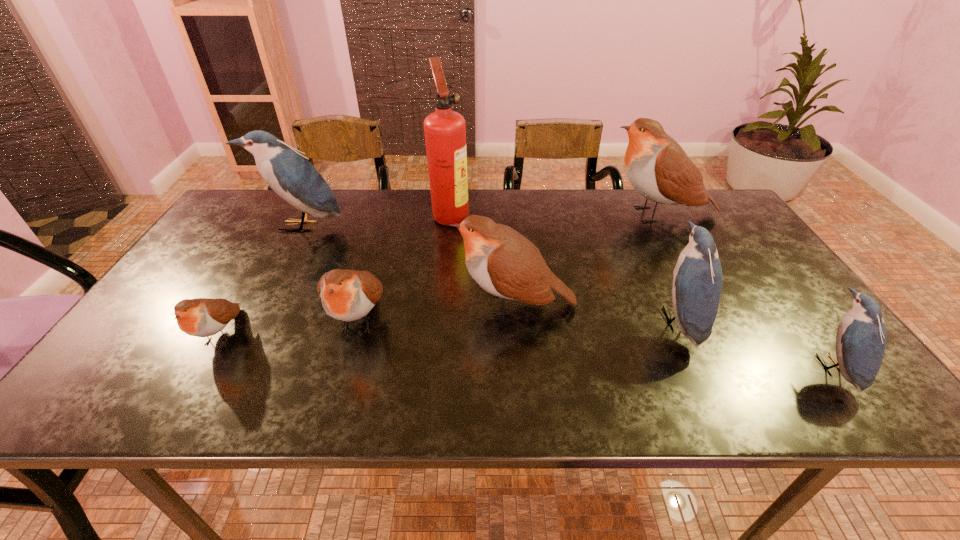
Where is `vacant region between the smallest brown bird and the biggest brown bird`? The height and width of the screenshot is (540, 960). vacant region between the smallest brown bird and the biggest brown bird is located at coordinates (441, 274).

In order to click on free spot between the rightmost brown bird and the fire extinguisher in this screenshot , I will do point(554,214).

Image resolution: width=960 pixels, height=540 pixels. In order to click on free space between the third brown bird from right to left and the shortest object in this screenshot , I will do `click(290, 327)`.

Identify the location of vacant region between the fire extinguisher and the third biggest brown bird. The width and height of the screenshot is (960, 540). (404, 267).

Image resolution: width=960 pixels, height=540 pixels. I want to click on vacant space that's between the farthest brown bird and the second biggest blue bird, so click(668, 267).

This screenshot has height=540, width=960. I want to click on unoccupied area between the third brown bird from left to right and the shortest bird, so click(x=368, y=320).

What are the coordinates of `vacant area between the sixth object from right to left and the second blue bird from right to left` in the screenshot? It's located at (518, 320).

Locate an element on the screen. Image resolution: width=960 pixels, height=540 pixels. the sixth closest object to the farthest blue bird is located at coordinates (697, 277).

Where is `object that can be found as the fifth closest to the rightmost brown bird`? Image resolution: width=960 pixels, height=540 pixels. object that can be found as the fifth closest to the rightmost brown bird is located at coordinates (347, 295).

Choose which bird is the third nearest neighbor to the fire extinguisher. Please provide its 2D coordinates. Your answer should be formatted as a tuple, i.e. [(x, y)], where the tuple contains the x and y coordinates of a point satisfying the conditions above.

[(347, 295)]